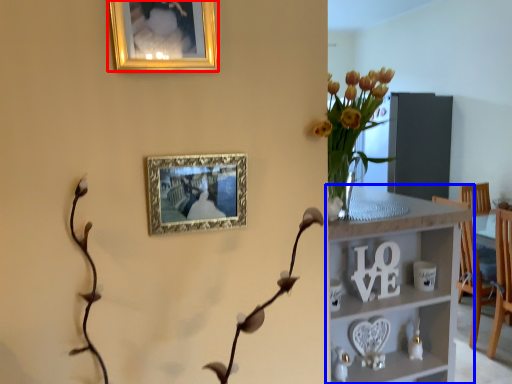
Question: Which point is closer to the camera, picture frame (highlighted by a red box) or shelf (highlighted by a blue box)?

Choices:
 (A) picture frame
 (B) shelf

Answer: (A)